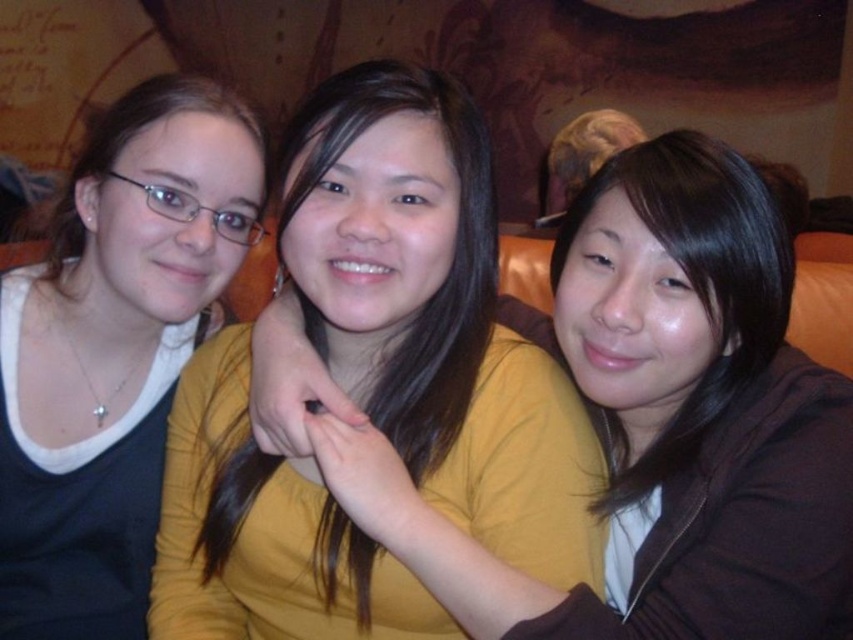
Question: Which object appears closest to the camera in this image?

Choices:
 (A) yellow matte shirt at center
 (B) matte black shirt at left

Answer: (A)

Question: Does yellow matte shirt at center have a larger size compared to matte black shirt at left?

Choices:
 (A) no
 (B) yes

Answer: (B)

Question: Can you confirm if yellow matte shirt at center is smaller than matte black shirt at left?

Choices:
 (A) yes
 (B) no

Answer: (B)

Question: Is yellow matte shirt at center positioned before matte black shirt at left?

Choices:
 (A) yes
 (B) no

Answer: (A)

Question: Which point is farther to the camera?

Choices:
 (A) yellow matte shirt at center
 (B) matte black shirt at left

Answer: (B)

Question: Which point is farther from the camera taking this photo?

Choices:
 (A) (219, 256)
 (B) (431, 147)

Answer: (A)